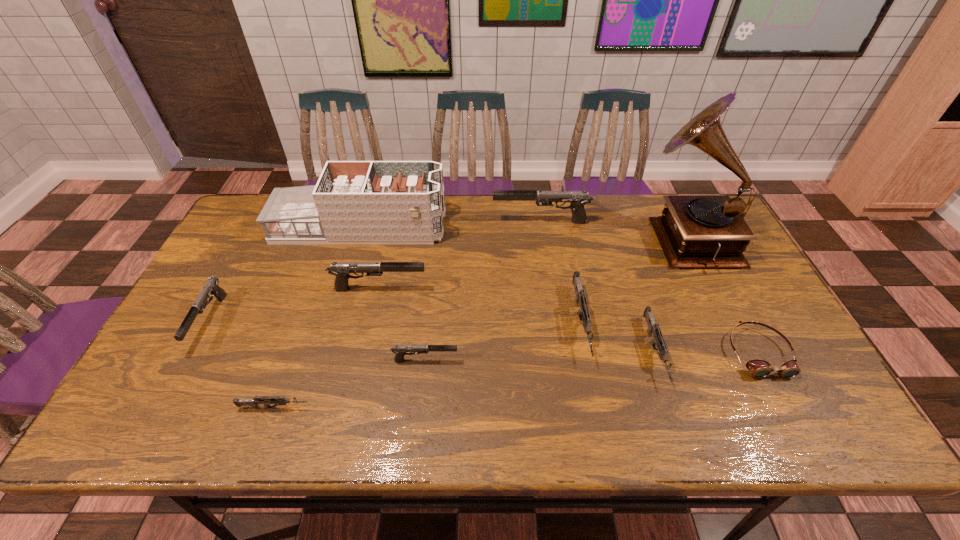
Identify the location of the second closest grey gun relative to the leftmost gun. (583, 313).

This screenshot has width=960, height=540. Find the location of `grey gun that is the third closest to the nearest gray gun`. grey gun that is the third closest to the nearest gray gun is located at coordinates (653, 327).

The height and width of the screenshot is (540, 960). In order to click on free region that satisfies the following two spatial constraints: 1. on the horn of the brown record player; 2. aimed along the barrel of the second grey gun from right to left in this screenshot , I will do point(729,323).

What are the coordinates of `free location that satisfies the following two spatial constraints: 1. aimed along the barrel of the second grey gun from left to right; 2. at the muzzle end of the smallest gray gun` in the screenshot? It's located at (588, 360).

Find the location of a particular element. Image resolution: width=960 pixels, height=540 pixels. vacant space that satisfies the following two spatial constraints: 1. through the lenses of the goggles; 2. aimed along the barrel of the nearest gun is located at coordinates (787, 408).